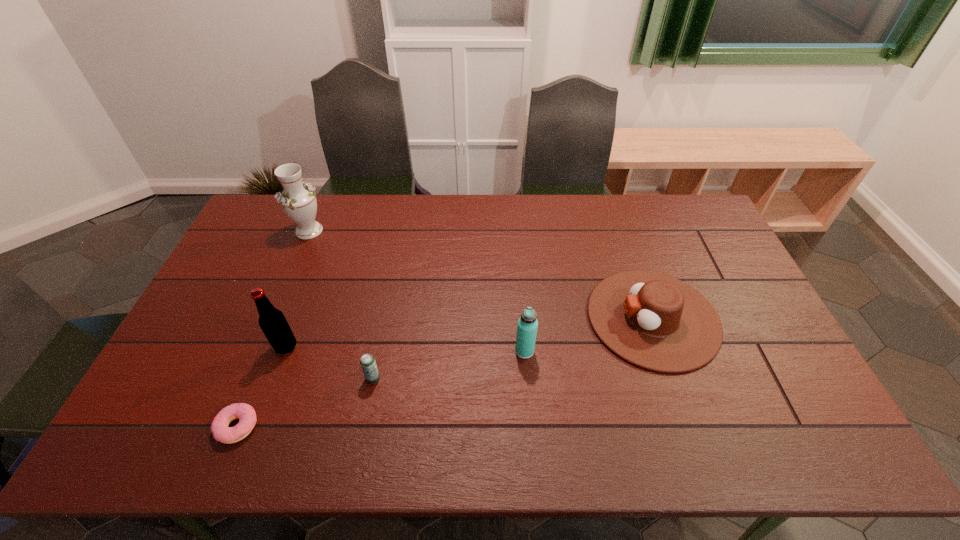
The height and width of the screenshot is (540, 960). What are the coordinates of `free space located on the right of the beer bottle` in the screenshot? It's located at (351, 347).

You are a GUI agent. You are given a task and a screenshot of the screen. Output one action in this format:
    pyautogui.click(x=<x>, y=<y>)
    Task: Click on the free space located on the right of the thermos bottle
    
    Given the screenshot: What is the action you would take?
    pyautogui.click(x=578, y=351)

I want to click on free space located on the front-facing side of the cowboy hat, so click(x=486, y=318).

Find the location of a particular element. This screenshot has width=960, height=540. vacant space located on the front-facing side of the cowboy hat is located at coordinates (540, 318).

At what (x,y) coordinates should I click in order to perform the action: click on free space located on the front-facing side of the cowboy hat. Please return your answer as a coordinate pair (x, y). Image resolution: width=960 pixels, height=540 pixels. Looking at the image, I should click on (530, 318).

The width and height of the screenshot is (960, 540). Find the location of `vacant space located on the back of the fifth tallest object`. vacant space located on the back of the fifth tallest object is located at coordinates (384, 319).

In order to click on free region located 0.110m on the left of the doughnut in this screenshot , I will do `click(171, 427)`.

You are a GUI agent. You are given a task and a screenshot of the screen. Output one action in this format:
    pyautogui.click(x=<x>, y=<y>)
    Task: Click on the object located in the far edge section of the desktop
    This screenshot has height=540, width=960.
    Given the screenshot: What is the action you would take?
    pyautogui.click(x=298, y=201)

Identify the location of object present at the near edge. (244, 412).

The height and width of the screenshot is (540, 960). Find the location of `object at the left edge`. object at the left edge is located at coordinates (298, 201).